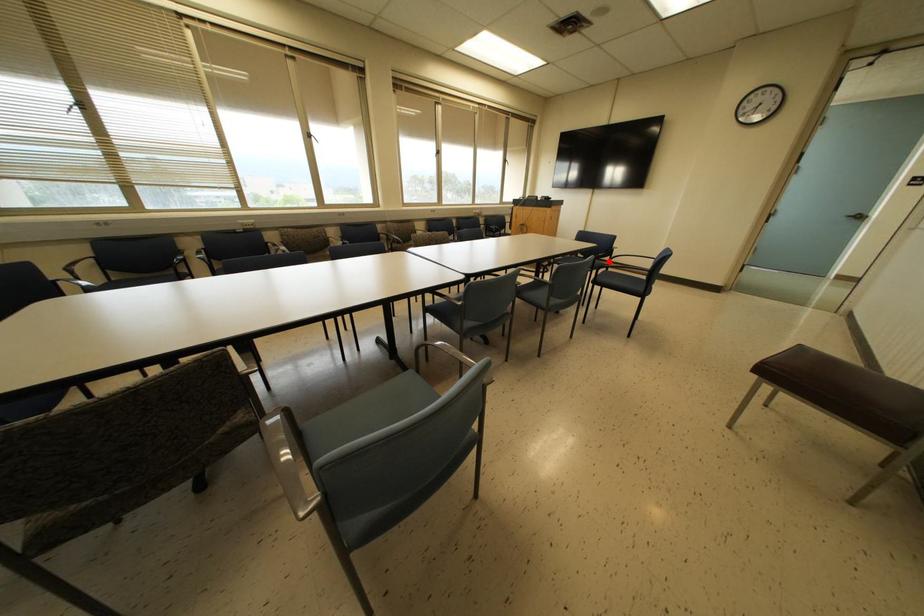
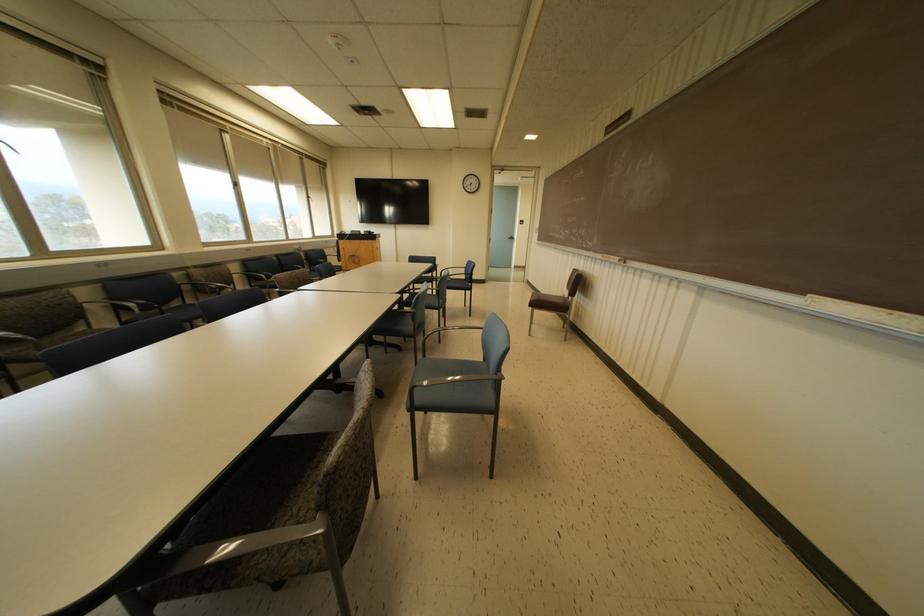
Question: I am providing you with two images of the same scene from different viewpoints. Image1 has a red point marked. In image2, the corresponding 3D location appears at what relative position? Reply with the corresponding letter.

Choices:
 (A) Closer
 (B) Farther

Answer: (A)